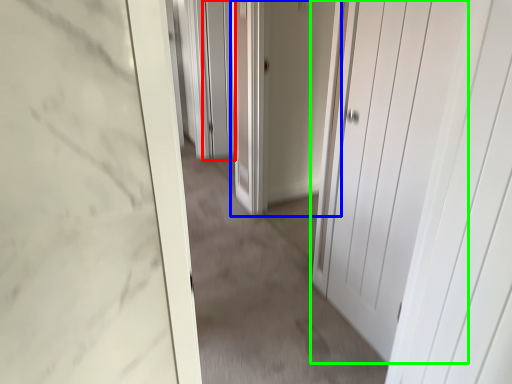
Question: Which object is positioned closest to screen door (highlighted by a red box)? Select from door (highlighted by a blue box) and door (highlighted by a green box).

Choices:
 (A) door
 (B) door

Answer: (A)